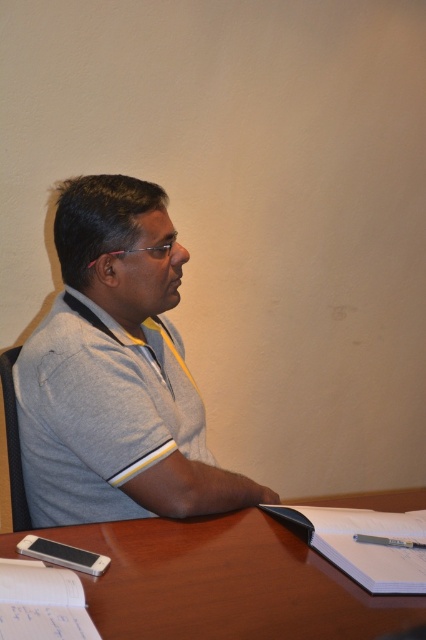
You are organizing items on a table and need to place a new item between the gray cotton shirt at center and the metallic pen at lower center. Based on their positions, where should you position the new item?

The gray cotton shirt at center is located above the metallic pen at lower center, so you should place the new item between them by positioning it below the gray cotton shirt at center and above the metallic pen at lower center.

What is located at the coordinates point (115, 372) in the image?

The coordinates point (115, 372) marks the gray cotton shirt at center.

What are the coordinates of the gray cotton shirt at center in the image?

The gray cotton shirt at center is located at coordinates point (115, 372).